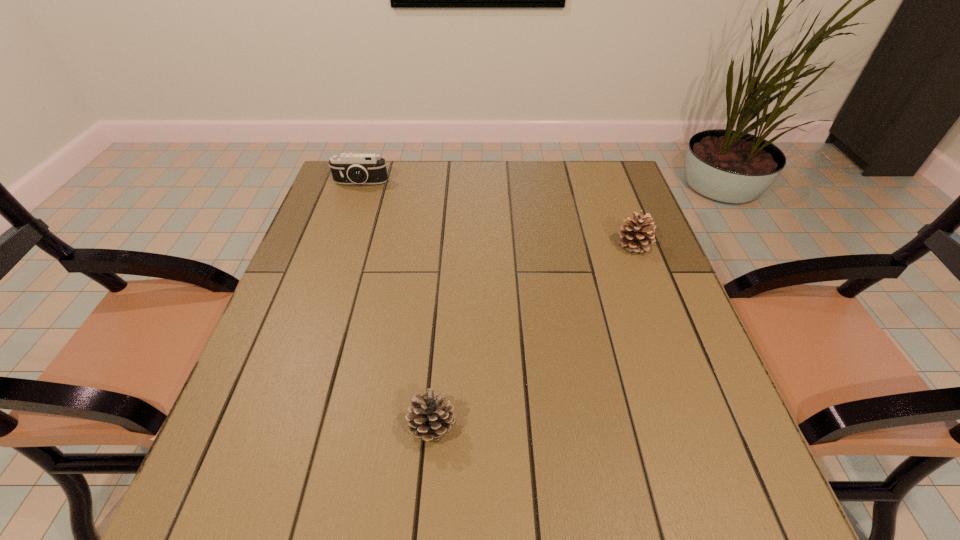
The height and width of the screenshot is (540, 960). I want to click on free space that satisfies the following two spatial constraints: 1. on the front lens of the right pinecone; 2. on the left side of the farthest object, so click(x=340, y=245).